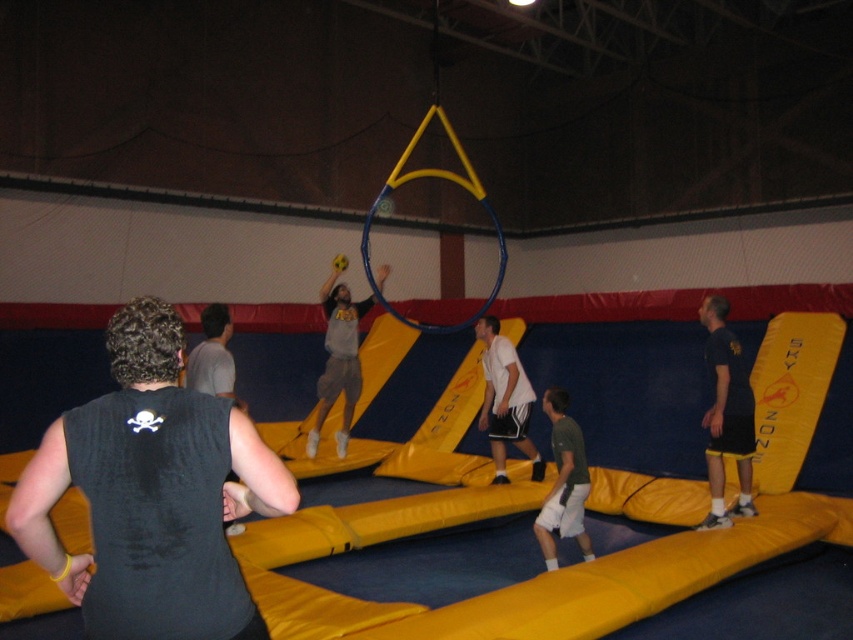
Who is positioned more to the left, white matte shorts at center or gray fabric shirt at center?

gray fabric shirt at center is more to the left.

Can you confirm if white matte shorts at center is positioned below gray fabric shirt at center?

Correct, white matte shorts at center is located below gray fabric shirt at center.

Which is behind, point (490, 449) or point (347, 308)?

The point (490, 449) is more distant.

The height and width of the screenshot is (640, 853). I want to click on white matte shorts at center, so click(x=505, y=400).

Does green matte shirt at center have a larger size compared to gray fabric shirt at left?

Actually, green matte shirt at center might be smaller than gray fabric shirt at left.

Is point (560, 474) farther from camera compared to point (216, 324)?

Yes, point (560, 474) is farther from viewer.

Which is in front, point (552, 566) or point (216, 392)?

Point (216, 392)

The height and width of the screenshot is (640, 853). I want to click on green matte shirt at center, so click(563, 483).

Is dark blue shorts at right shorter than gray fabric shirt at center?

Yes, dark blue shorts at right is shorter than gray fabric shirt at center.

Which is behind, point (712, 474) or point (345, 403)?

The point (345, 403) is more distant.

Where is `dark blue shorts at right`? This screenshot has height=640, width=853. dark blue shorts at right is located at coordinates (726, 413).